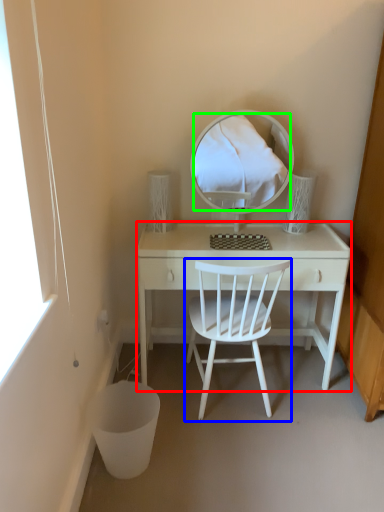
Question: Which object is positioned farthest from desk (highlighted by a red box)? Select from chair (highlighted by a blue box) and mirror (highlighted by a green box).

Choices:
 (A) chair
 (B) mirror

Answer: (B)